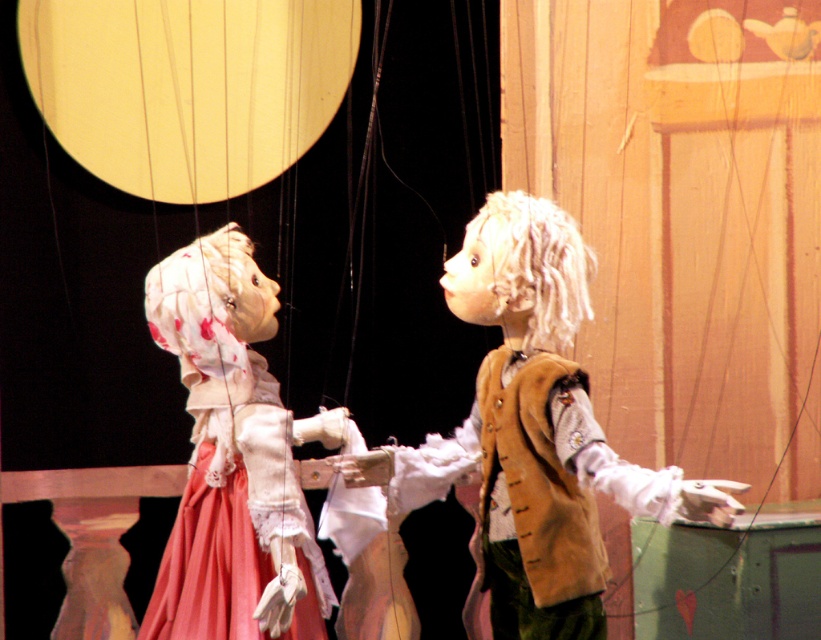
Does matte white doll at left appear on the left side of brown suede vest at center?

Yes, matte white doll at left is to the left of brown suede vest at center.

This screenshot has height=640, width=821. In order to click on matte white doll at left in this screenshot , I will do `click(232, 460)`.

This screenshot has width=821, height=640. Describe the element at coordinates (533, 433) in the screenshot. I see `velvet brown vest at center` at that location.

Is velvet brown vest at center above matte white doll at left?

Indeed, velvet brown vest at center is positioned over matte white doll at left.

Identify the location of velvet brown vest at center. (533, 433).

Consider the image. Between velvet brown vest at center and brown suede vest at center, which one is positioned higher?

velvet brown vest at center is above.

Describe the element at coordinates (533, 433) in the screenshot. I see `velvet brown vest at center` at that location.

This screenshot has height=640, width=821. Identify the location of velvet brown vest at center. (533, 433).

Locate an element on the screen. velvet brown vest at center is located at coordinates click(533, 433).